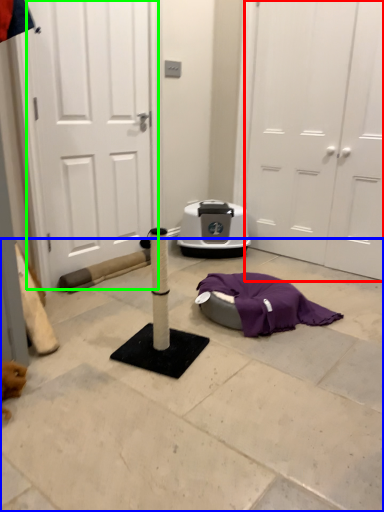
Question: Estimate the real-world distances between objects in this image. Which object is farther from door (highlighted by a red box), concrete (highlighted by a blue box) or door (highlighted by a green box)?

Choices:
 (A) concrete
 (B) door

Answer: (A)